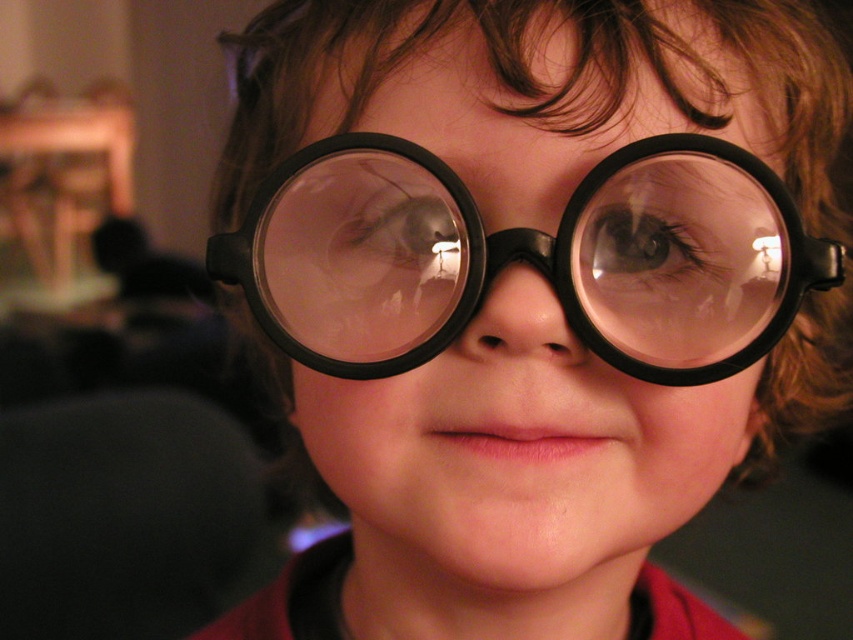
Is brown matte eye at center bigger than translucent plastic eye at center?

Actually, brown matte eye at center might be smaller than translucent plastic eye at center.

Does brown matte eye at center appear on the right side of translucent plastic eye at center?

Yes, brown matte eye at center is to the right of translucent plastic eye at center.

Who is more forward, (614, 228) or (364, 256)?

Positioned in front is point (614, 228).

The image size is (853, 640). I want to click on brown matte eye at center, so coord(654,248).

Can you confirm if black matte goggles at center is taller than translucent plastic eye at center?

Correct, black matte goggles at center is much taller as translucent plastic eye at center.

Is black matte goggles at center bigger than translucent plastic eye at center?

Indeed, black matte goggles at center has a larger size compared to translucent plastic eye at center.

Does point (712, 243) come behind point (376, 228)?

Yes.

This screenshot has width=853, height=640. What are the coordinates of `black matte goggles at center` in the screenshot? It's located at (x=525, y=257).

Who is positioned more to the left, black matte goggles at center or brown matte eye at center?

Positioned to the left is black matte goggles at center.

Is black matte goggles at center to the left of brown matte eye at center from the viewer's perspective?

Correct, you'll find black matte goggles at center to the left of brown matte eye at center.

The width and height of the screenshot is (853, 640). What do you see at coordinates (525, 257) in the screenshot?
I see `black matte goggles at center` at bounding box center [525, 257].

At what (x,y) coordinates should I click in order to perform the action: click on black matte goggles at center. Please return your answer as a coordinate pair (x, y). Looking at the image, I should click on (525, 257).